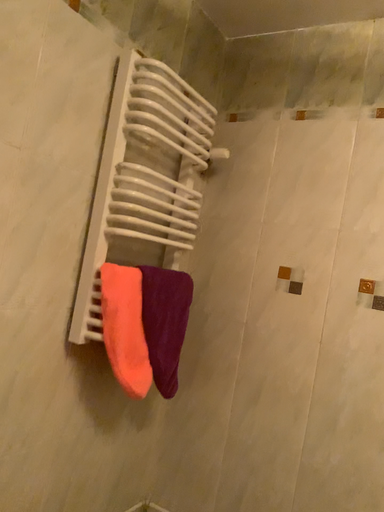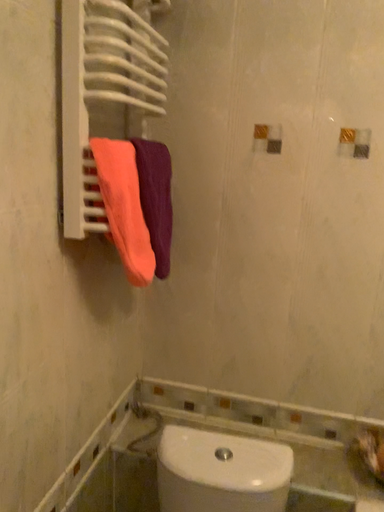
Question: Which way did the camera rotate in the video?

Choices:
 (A) rotated right
 (B) rotated left

Answer: (A)